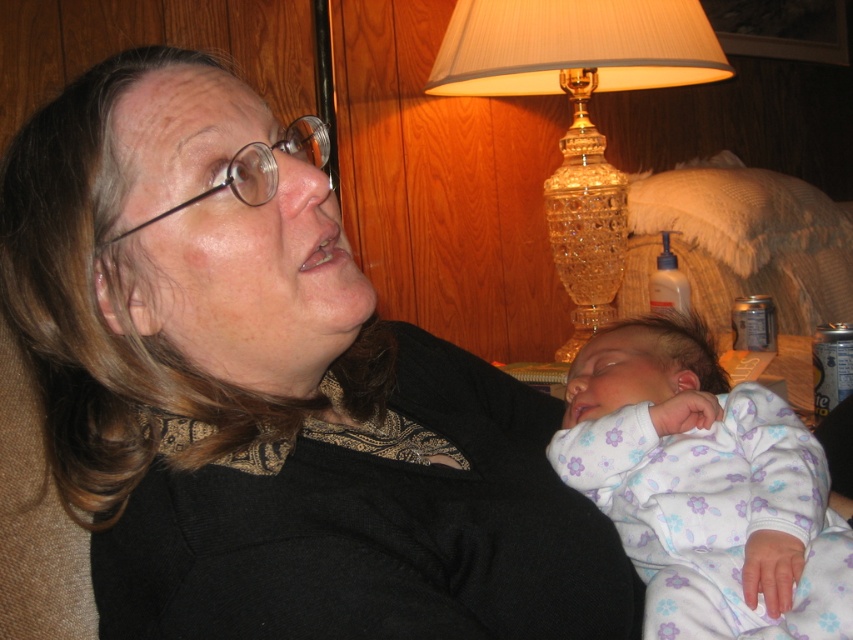
Question: Is floral cotton onesie at lower right to the left of crystal glass lamp at upper right from the viewer's perspective?

Choices:
 (A) yes
 (B) no

Answer: (A)

Question: Observing the image, what is the correct spatial positioning of floral cotton onesie at lower right in reference to crystal glass lamp at upper right?

Choices:
 (A) right
 (B) left

Answer: (B)

Question: Which object is positioned closest to the crystal glass lamp at upper right?

Choices:
 (A) floral cotton onesie at lower right
 (B) matte black sweater at center

Answer: (A)

Question: Estimate the real-world distances between objects in this image. Which object is closer to the floral cotton onesie at lower right?

Choices:
 (A) matte black sweater at center
 (B) crystal glass lamp at upper right

Answer: (A)

Question: Which object is the farthest from the crystal glass lamp at upper right?

Choices:
 (A) matte black sweater at center
 (B) floral cotton onesie at lower right

Answer: (A)

Question: Does floral cotton onesie at lower right appear over crystal glass lamp at upper right?

Choices:
 (A) yes
 (B) no

Answer: (B)